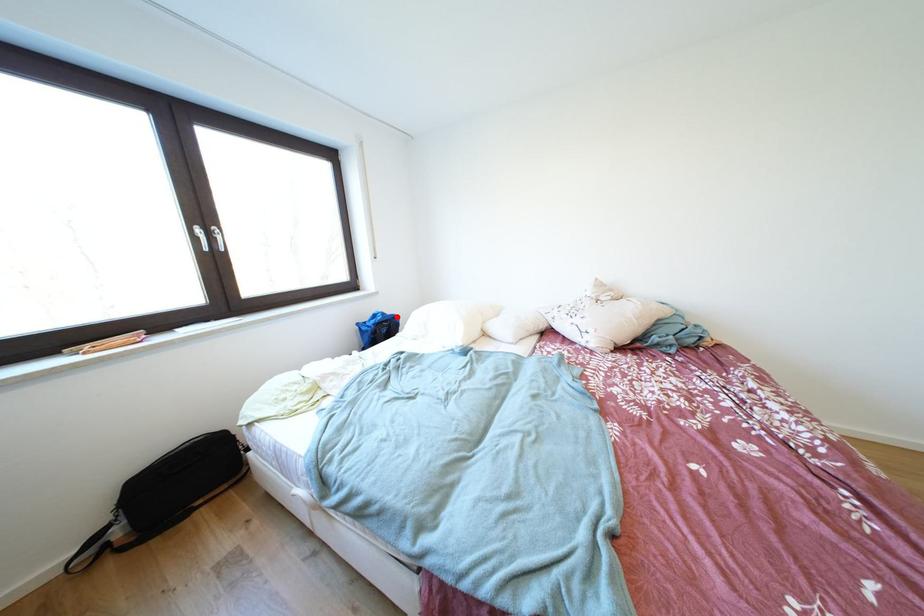
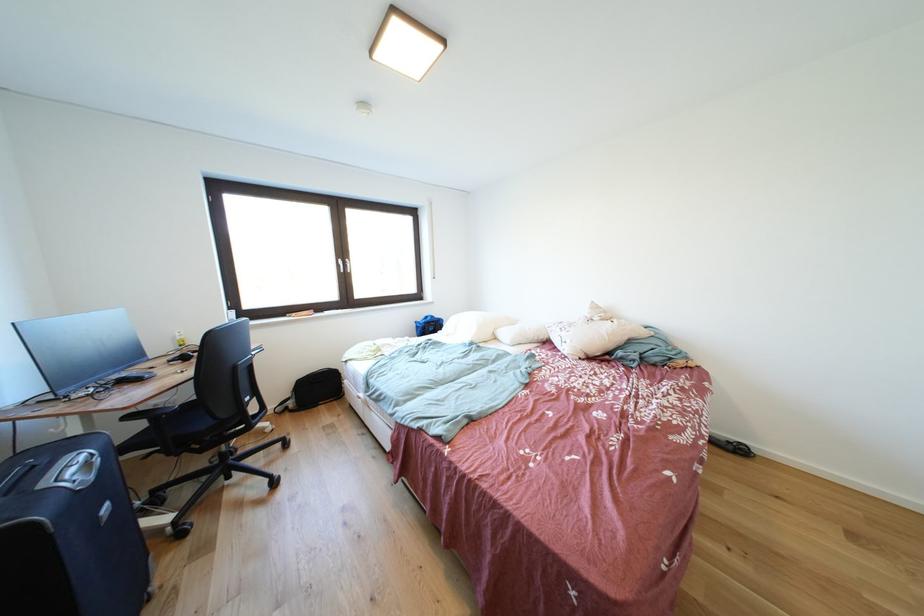
Where in the second image is the point corresponding to the highlighted location from the first image?

(445, 321)